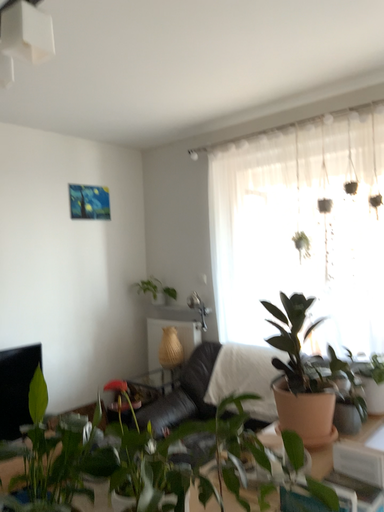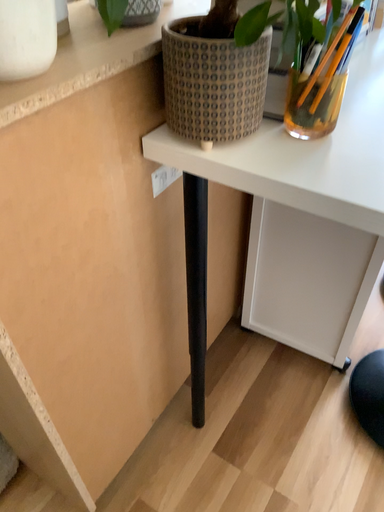
Question: Which way did the camera rotate in the video?

Choices:
 (A) rotated right
 (B) rotated left

Answer: (A)